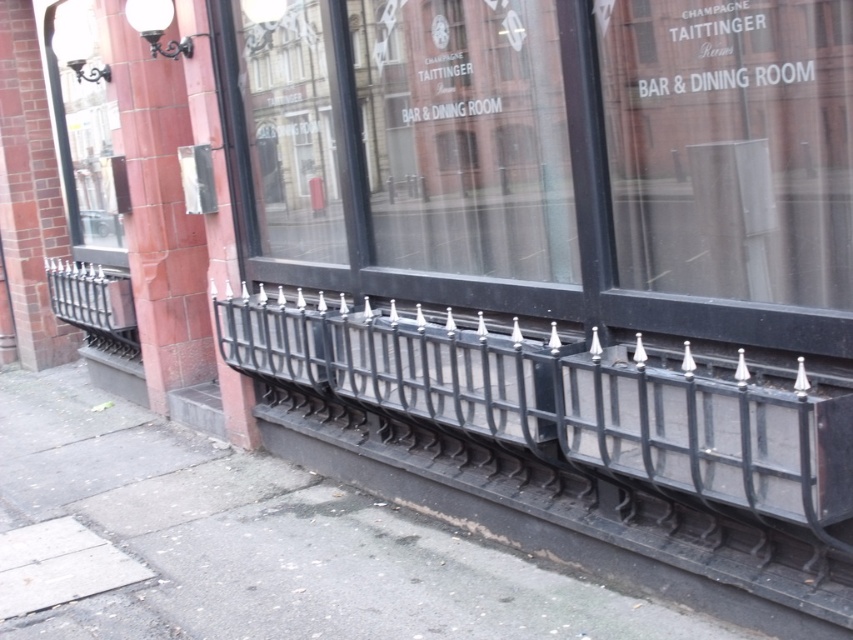
Question: Does black metal railing at lower center come behind black wrought iron fence at lower center?

Choices:
 (A) no
 (B) yes

Answer: (B)

Question: Does black metal railing at lower center have a larger size compared to black wrought iron fence at lower center?

Choices:
 (A) yes
 (B) no

Answer: (B)

Question: Observing the image, what is the correct spatial positioning of black wrought iron fence at lower center in reference to matte glass window at upper left?

Choices:
 (A) left
 (B) right

Answer: (B)

Question: Among these objects, which one is farthest from the camera?

Choices:
 (A) black wrought iron fence at lower center
 (B) transparent glass window at center

Answer: (B)

Question: Which object is positioned closest to the black wrought iron fence at lower center?

Choices:
 (A) black metal railing at lower center
 (B) matte glass window at upper left

Answer: (A)

Question: Which object appears closest to the camera in this image?

Choices:
 (A) black metal railing at lower center
 (B) black wrought iron fence at lower center
 (C) matte glass window at upper left
 (D) transparent glass window at center

Answer: (B)